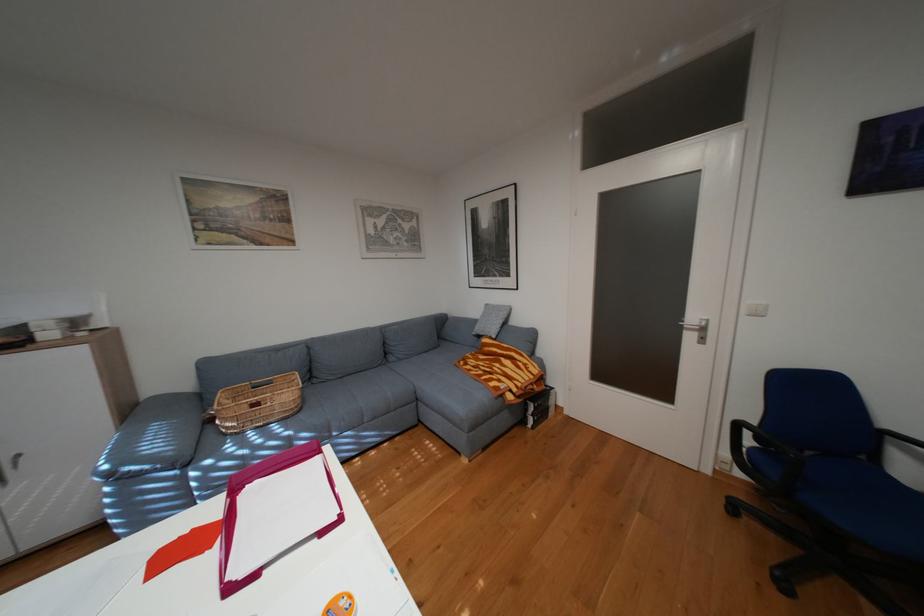
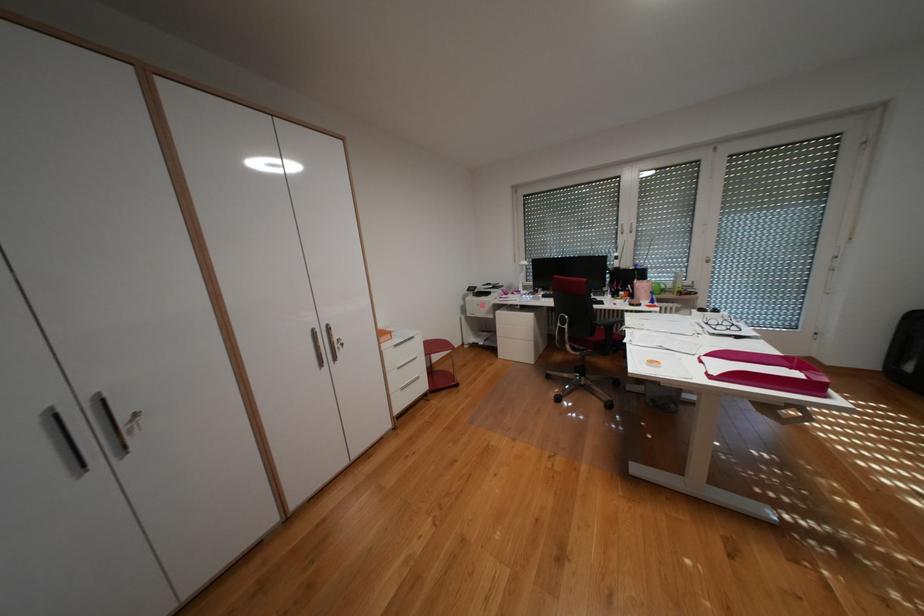
Locate, in the second image, the point that corresponds to [353,519] in the first image.

(723, 377)